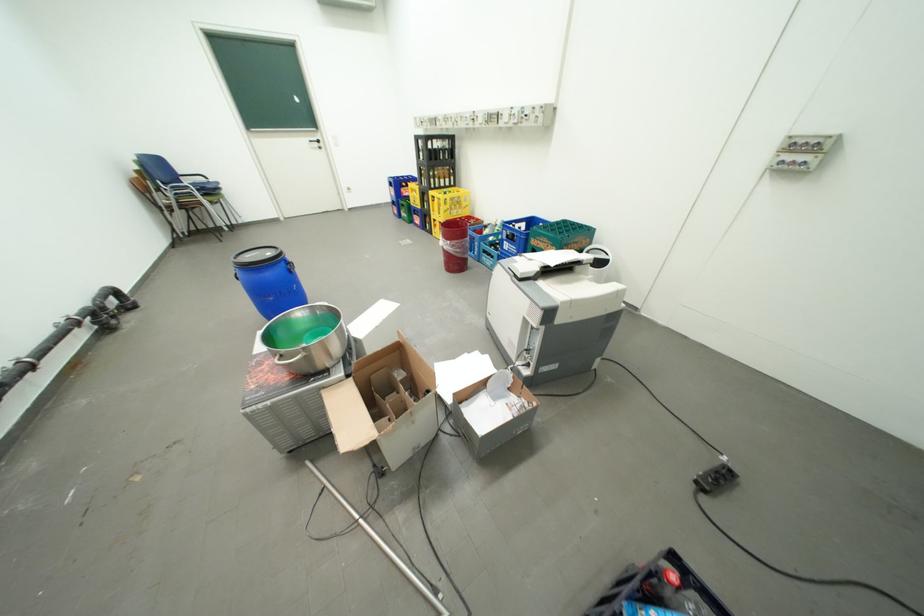
Find the location of a particular element. Image resolution: width=924 pixels, height=616 pixels. yellow bottle crate is located at coordinates (448, 201).